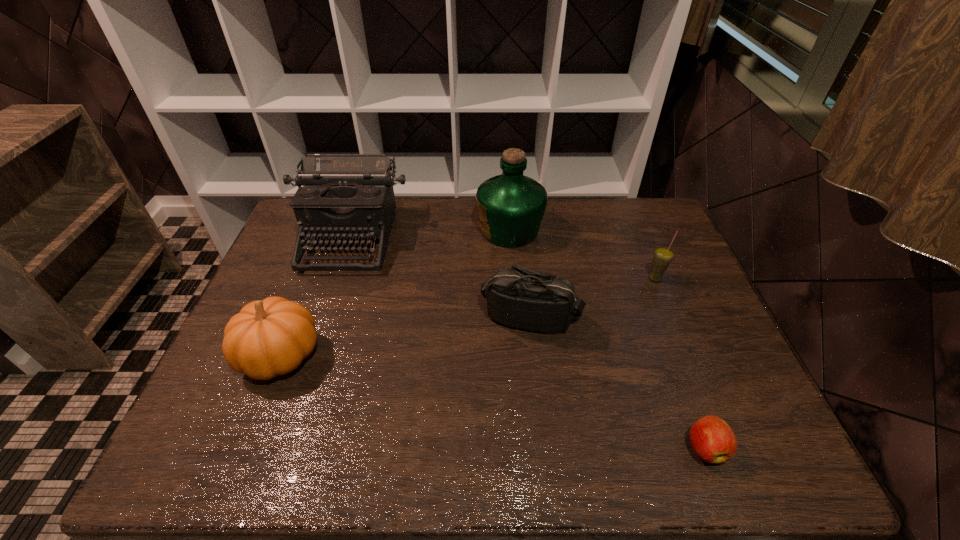
Identify the location of liquor. The height and width of the screenshot is (540, 960). (511, 206).

Where is `typewriter`? typewriter is located at coordinates (344, 196).

Identify the location of shoulder bag. (518, 297).

The image size is (960, 540). I want to click on pumpkin, so click(270, 337).

Identify the location of straw for drinking. (663, 256).

Image resolution: width=960 pixels, height=540 pixels. What are the coordinates of `apple` in the screenshot? It's located at (713, 440).

I want to click on the nearest object, so click(x=713, y=440).

The height and width of the screenshot is (540, 960). I want to click on vacant position located on the label side of the liquor, so click(363, 230).

Find the location of a particular element. The image size is (960, 540). vacant space located on the label side of the liquor is located at coordinates coord(434,230).

Where is `vacant region located on the label side of the liquor`? The height and width of the screenshot is (540, 960). vacant region located on the label side of the liquor is located at coordinates (366, 230).